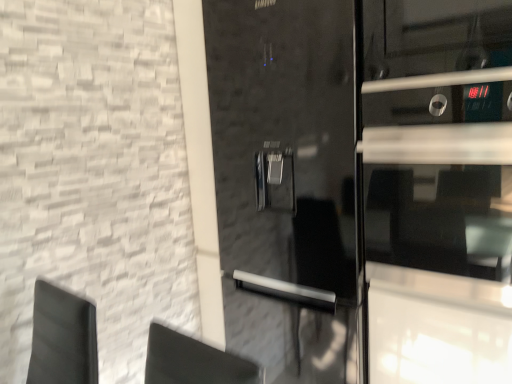
Question: Is black glossy oven door at right completely or partially inside glossy black refrigerator at center?

Choices:
 (A) no
 (B) yes

Answer: (A)

Question: From the image's perspective, is glossy black refrigerator at center located above black glossy oven door at right?

Choices:
 (A) no
 (B) yes

Answer: (A)

Question: Is glossy black refrigerator at center outside of black glossy oven door at right?

Choices:
 (A) yes
 (B) no

Answer: (A)

Question: Considering the relative sizes of glossy black refrigerator at center and black glossy oven door at right in the image provided, is glossy black refrigerator at center taller than black glossy oven door at right?

Choices:
 (A) yes
 (B) no

Answer: (A)

Question: Considering the relative sizes of glossy black refrigerator at center and black glossy oven door at right in the image provided, is glossy black refrigerator at center thinner than black glossy oven door at right?

Choices:
 (A) yes
 (B) no

Answer: (B)

Question: From a real-world perspective, is glossy black refrigerator at center located higher than black glossy oven door at right?

Choices:
 (A) no
 (B) yes

Answer: (A)

Question: Is black glossy oven door at right at the left side of glossy black refrigerator at center?

Choices:
 (A) yes
 (B) no

Answer: (B)

Question: Is black glossy oven door at right closer to the viewer compared to glossy black refrigerator at center?

Choices:
 (A) yes
 (B) no

Answer: (A)

Question: Can you confirm if black glossy oven door at right is bigger than glossy black refrigerator at center?

Choices:
 (A) yes
 (B) no

Answer: (B)

Question: Does black glossy oven door at right lie behind glossy black refrigerator at center?

Choices:
 (A) no
 (B) yes

Answer: (A)

Question: Is black glossy oven door at right looking in the opposite direction of glossy black refrigerator at center?

Choices:
 (A) yes
 (B) no

Answer: (B)

Question: Can you confirm if black glossy oven door at right is taller than glossy black refrigerator at center?

Choices:
 (A) yes
 (B) no

Answer: (B)

Question: From the image's perspective, is glossy black refrigerator at center above or below black glossy oven door at right?

Choices:
 (A) above
 (B) below

Answer: (B)